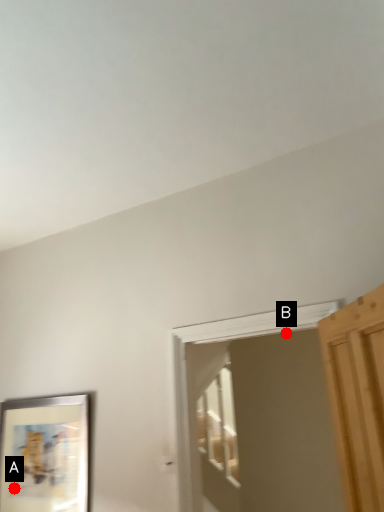
Question: Two points are circled on the image, labeled by A and B beside each circle. Which point appears farthest from the camera in this image?

Choices:
 (A) A is further
 (B) B is further

Answer: (B)